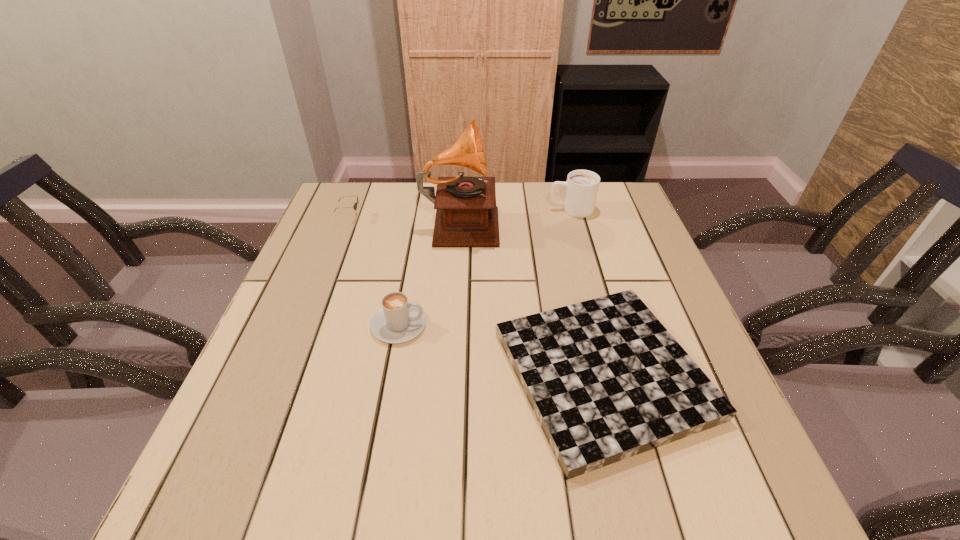
Where is `vacant point that satisfies the following two spatial constraints: 1. on the horn of the phonograph record; 2. on the right side of the checkerboard`? The image size is (960, 540). vacant point that satisfies the following two spatial constraints: 1. on the horn of the phonograph record; 2. on the right side of the checkerboard is located at coordinates (x=452, y=374).

This screenshot has width=960, height=540. In order to click on free point that satisfies the following two spatial constraints: 1. on the horn of the tallest object; 2. on the back side of the checkerboard in this screenshot , I will do `click(452, 374)`.

Locate an element on the screen. Image resolution: width=960 pixels, height=540 pixels. free spot that satisfies the following two spatial constraints: 1. to the right of the checkerboard; 2. on the left side of the shorter cappuccino is located at coordinates (390, 374).

You are a GUI agent. You are given a task and a screenshot of the screen. Output one action in this format:
    pyautogui.click(x=<x>, y=<y>)
    Task: Click on the vacant space that satisfies the following two spatial constraints: 1. on the back side of the checkerboard; 2. on the horn of the phonograph record
    The height and width of the screenshot is (540, 960).
    Given the screenshot: What is the action you would take?
    pyautogui.click(x=564, y=220)

At what (x,y) coordinates should I click in order to perform the action: click on free space in the image that satisfies the following two spatial constraints: 1. on the horn of the checkerboard; 2. on the right side of the tallest object. Please return your answer as a coordinate pair (x, y). The width and height of the screenshot is (960, 540). Looking at the image, I should click on (x=452, y=374).

This screenshot has width=960, height=540. I want to click on free point that satisfies the following two spatial constraints: 1. to the right of the shortest object; 2. on the left side of the nearer cappuccino, so click(x=390, y=374).

Where is `blank area in the image that satisfies the following two spatial constraints: 1. on the side with the handle of the farther cappuccino; 2. on the front side of the checkerboard`? The height and width of the screenshot is (540, 960). blank area in the image that satisfies the following two spatial constraints: 1. on the side with the handle of the farther cappuccino; 2. on the front side of the checkerboard is located at coordinates (616, 374).